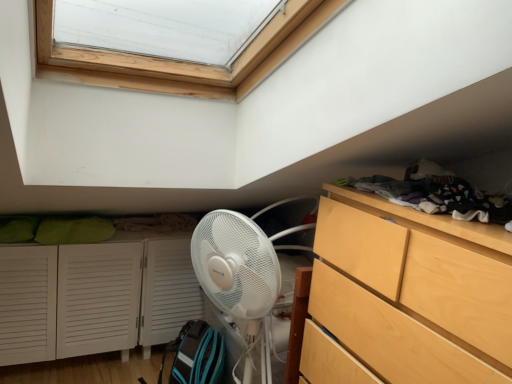
Describe the element at coordinates (438, 196) in the screenshot. The width and height of the screenshot is (512, 384). I see `dark gray fabric at upper right` at that location.

Find the location of a particular element. light wood/texture chest of drawers at right is located at coordinates (413, 290).

Is light wood/texture chest of drawers at right directly adjacent to white louvered cabinet at lower left?

light wood/texture chest of drawers at right and white louvered cabinet at lower left are clearly separated.

Which is behind, point (402, 247) or point (144, 278)?

Positioned behind is point (144, 278).

Is light wood/texture chest of drawers at right in front of or behind white louvered cabinet at lower left in the image?

light wood/texture chest of drawers at right is in front of white louvered cabinet at lower left.

Based on the photo, between light wood/texture chest of drawers at right and white louvered cabinet at lower left, which one has more height?

light wood/texture chest of drawers at right.

Can you see dark gray fabric at upper right touching light wood/texture chest of drawers at right?

They are not placed beside each other.

How different are the orientations of dark gray fabric at upper right and light wood/texture chest of drawers at right in degrees?

The angular difference between dark gray fabric at upper right and light wood/texture chest of drawers at right is 1.13 degrees.

Is dark gray fabric at upper right turned away from light wood/texture chest of drawers at right?

No, dark gray fabric at upper right is not facing the opposite direction of light wood/texture chest of drawers at right.

Looking at this image, which of these two, dark gray fabric at upper right or light wood/texture chest of drawers at right, is smaller?

With smaller size is dark gray fabric at upper right.

Is white louvered cabinet at lower left positioned with its back to dark gray fabric at upper right?

That's not correct — white louvered cabinet at lower left is not looking away from dark gray fabric at upper right.

Is white louvered cabinet at lower left bigger or smaller than dark gray fabric at upper right?

In the image, white louvered cabinet at lower left appears to be larger than dark gray fabric at upper right.

This screenshot has height=384, width=512. I want to click on cupboard on the left of dark gray fabric at upper right, so click(94, 297).

From the picture: Is white louvered cabinet at lower left completely or partially outside of dark gray fabric at upper right?

Yes, white louvered cabinet at lower left is located beyond the bounds of dark gray fabric at upper right.

I want to click on cupboard on the left of light wood/texture chest of drawers at right, so (x=94, y=297).

How different are the orientations of white louvered cabinet at lower left and light wood/texture chest of drawers at right in degrees?

white louvered cabinet at lower left and light wood/texture chest of drawers at right are facing 90.8 degrees away from each other.

Does white louvered cabinet at lower left have a larger size compared to light wood/texture chest of drawers at right?

Yes, white louvered cabinet at lower left is bigger than light wood/texture chest of drawers at right.

Is white louvered cabinet at lower left looking in the opposite direction of light wood/texture chest of drawers at right?

Result: No.

In the scene shown: Is dark gray fabric at upper right turned away from white louvered cabinet at lower left?

No, dark gray fabric at upper right is not facing away from white louvered cabinet at lower left.

Is dark gray fabric at upper right not near white louvered cabinet at lower left?

Yes, dark gray fabric at upper right and white louvered cabinet at lower left are quite far apart.

Locate an element on the screen. laundry above the white louvered cabinet at lower left (from the image's perspective) is located at coordinates point(438,196).

From a real-world perspective, is dark gray fabric at upper right positioned above or below white louvered cabinet at lower left?

dark gray fabric at upper right is above white louvered cabinet at lower left.

Are light wood/texture chest of drawers at right and dark gray fabric at upper right far apart?

No, there isn't a large distance between light wood/texture chest of drawers at right and dark gray fabric at upper right.

Which is correct: light wood/texture chest of drawers at right is inside dark gray fabric at upper right, or outside of it?

light wood/texture chest of drawers at right is not enclosed by dark gray fabric at upper right.

Is point (319, 216) positioned after point (483, 215)?

Yes, point (319, 216) is farther from viewer.

How different are the orientations of light wood/texture chest of drawers at right and dark gray fabric at upper right in degrees?

The facing directions of light wood/texture chest of drawers at right and dark gray fabric at upper right are 1.13 degrees apart.

I want to click on chest of drawers on the right of white louvered cabinet at lower left, so click(413, 290).

This screenshot has width=512, height=384. What are the coordinates of `chest of drawers that appears on the left of dark gray fabric at upper right` in the screenshot? It's located at point(413,290).

Which object lies further to the anchor point white louvered cabinet at lower left, light wood/texture chest of drawers at right or dark gray fabric at upper right?

dark gray fabric at upper right is further to white louvered cabinet at lower left.

Looking at the image, which one is located closer to white louvered cabinet at lower left, dark gray fabric at upper right or light wood/texture chest of drawers at right?

light wood/texture chest of drawers at right is positioned closer to the anchor white louvered cabinet at lower left.

Consider the image. Which object lies nearer to the anchor point light wood/texture chest of drawers at right, white louvered cabinet at lower left or dark gray fabric at upper right?

dark gray fabric at upper right lies closer to light wood/texture chest of drawers at right than the other object.

Looking at the image, which one is located further to dark gray fabric at upper right, light wood/texture chest of drawers at right or white louvered cabinet at lower left?

white louvered cabinet at lower left is positioned further to the anchor dark gray fabric at upper right.

From the image, which object appears to be farther from light wood/texture chest of drawers at right, dark gray fabric at upper right or white louvered cabinet at lower left?

white louvered cabinet at lower left is further to light wood/texture chest of drawers at right.

Looking at this image, from the image, which object appears to be farther from dark gray fabric at upper right, white louvered cabinet at lower left or light wood/texture chest of drawers at right?

The object further to dark gray fabric at upper right is white louvered cabinet at lower left.

Where is `the chest of drawers located between white louvered cabinet at lower left and dark gray fabric at upper right in the left-right direction`? This screenshot has height=384, width=512. the chest of drawers located between white louvered cabinet at lower left and dark gray fabric at upper right in the left-right direction is located at coordinates (413, 290).